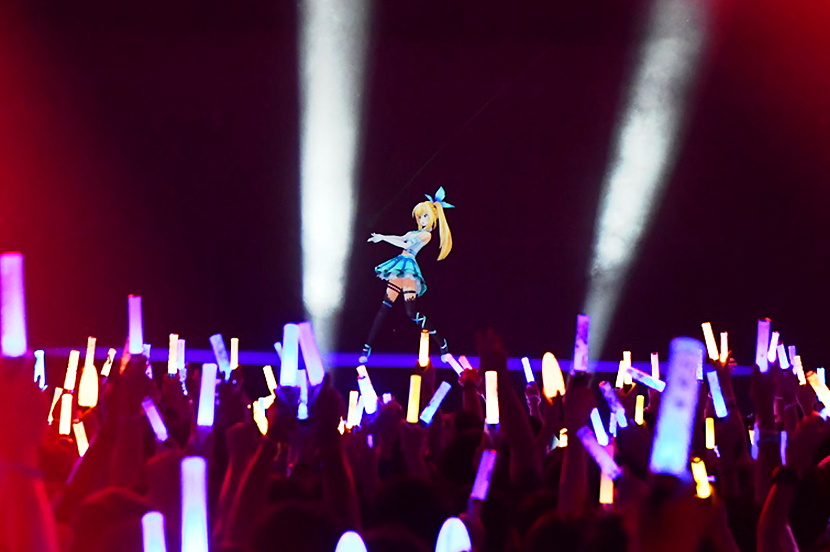
Find the location of a particular element. fans is located at coordinates (314, 517), (392, 513), (420, 502), (442, 467), (128, 440), (121, 498), (657, 508), (591, 468), (530, 399).